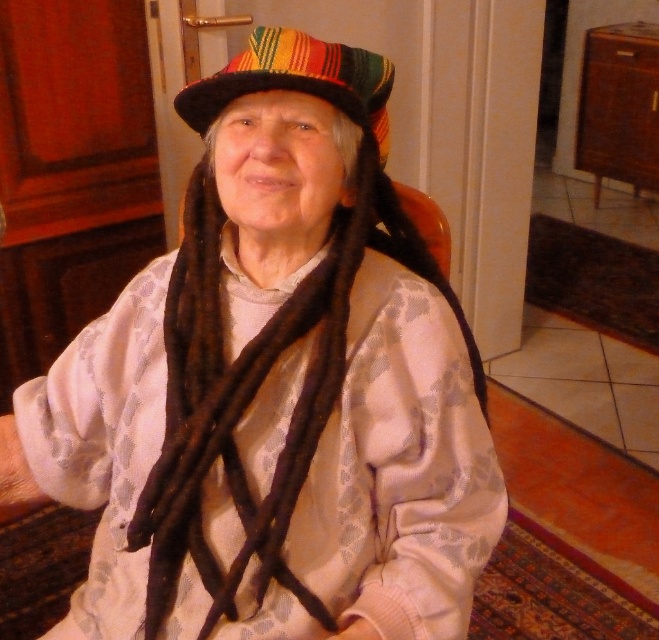
Based on the scene description, which hat at upper center has a greater width? The multicolored fabric hat at upper center or the striped fabric hat at upper center?

The multicolored fabric hat at upper center has a greater width than the striped fabric hat at upper center.

You are an interior designer observing the scene. You need to place a decorative item to the right of the multicolored fabric hat at upper center and to the left of the striped fabric hat at upper center. Is there enough space between them to place this item?

The multicolored fabric hat at upper center is to the left of the striped fabric hat at upper center, so there is space between them to place the decorative item.